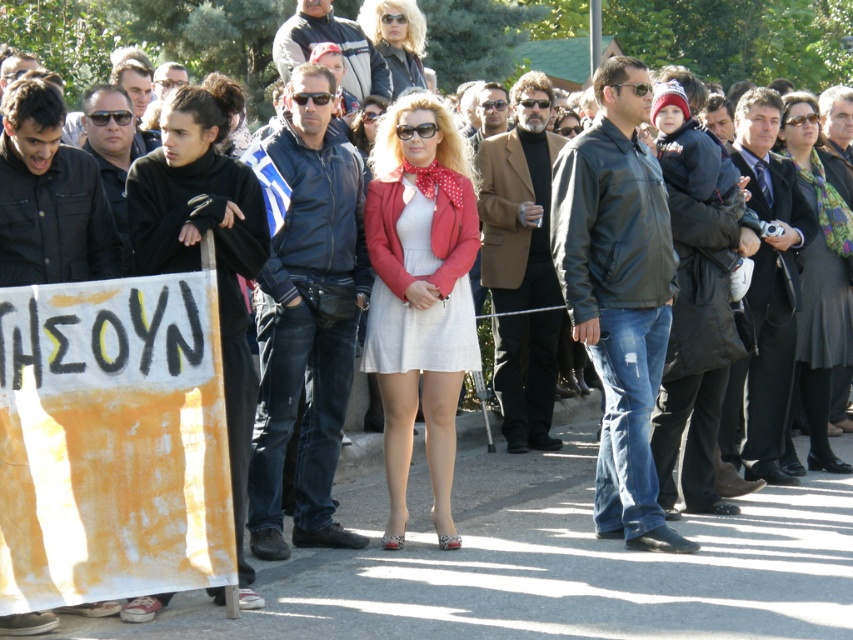
Is matte red jacket at center to the left of black matte coat at left from the viewer's perspective?

No, matte red jacket at center is not to the left of black matte coat at left.

Between point (373, 314) and point (247, 189), which one is positioned in front?

Point (247, 189) is in front.

Does point (451, 164) lie in front of point (231, 484)?

No, it is behind (231, 484).

In order to click on matte red jacket at center in this screenshot , I will do `click(419, 296)`.

Between point (181, 241) and point (817, 243), which one is positioned behind?

Point (817, 243)

Is the position of black matte coat at left more distant than that of dark gray wool coat at center?

No, black matte coat at left is in front of dark gray wool coat at center.

Is point (225, 161) positioned before point (809, 296)?

Yes, it is in front of point (809, 296).

Image resolution: width=853 pixels, height=640 pixels. In order to click on black matte coat at left in this screenshot , I will do `click(213, 248)`.

What do you see at coordinates (419, 296) in the screenshot?
I see `matte red jacket at center` at bounding box center [419, 296].

You are a GUI agent. You are given a task and a screenshot of the screen. Output one action in this format:
    pyautogui.click(x=<x>, y=<y>)
    Task: Click on the matte red jacket at center
    Image resolution: width=853 pixels, height=640 pixels.
    Given the screenshot: What is the action you would take?
    pyautogui.click(x=419, y=296)

Where is `matte red jacket at center`? matte red jacket at center is located at coordinates (419, 296).